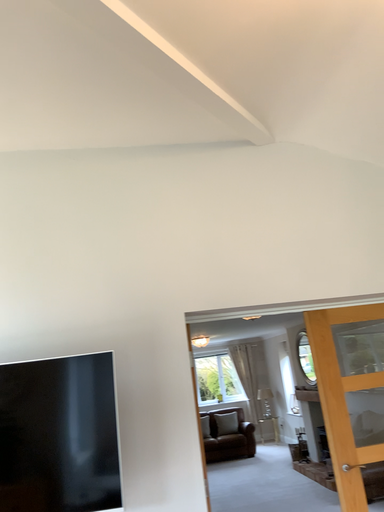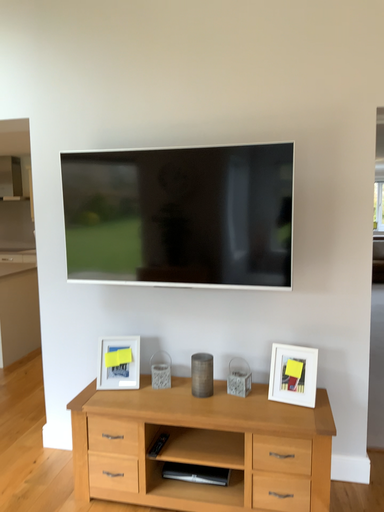
Question: How did the camera likely rotate when shooting the video?

Choices:
 (A) rotated left
 (B) rotated right

Answer: (A)